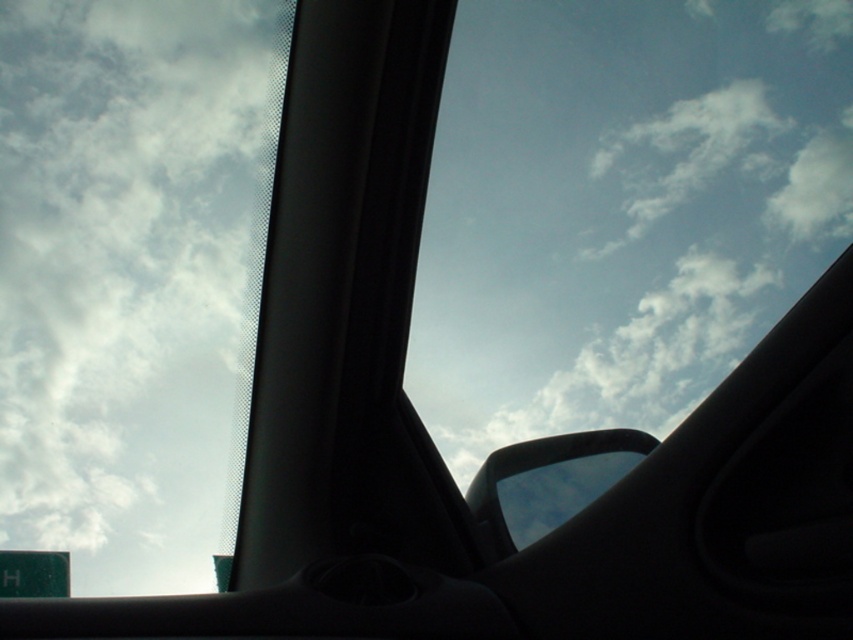
Which is more to the left, black glossy side mirror at center or green matte street sign at lower left?

From the viewer's perspective, green matte street sign at lower left appears more on the left side.

Where is `black glossy side mirror at center`? black glossy side mirror at center is located at coordinates (547, 483).

Does transparent glass car window at upper center have a greater width compared to black glossy side mirror at center?

Indeed, transparent glass car window at upper center has a greater width compared to black glossy side mirror at center.

Who is taller, transparent glass car window at upper center or black glossy side mirror at center?

transparent glass car window at upper center

Does point (766, 93) come closer to viewer compared to point (621, 474)?

No.

Where is `transparent glass car window at upper center`? This screenshot has width=853, height=640. transparent glass car window at upper center is located at coordinates (619, 209).

Between transparent glass car window at upper center and green matte street sign at lower left, which one is positioned higher?

transparent glass car window at upper center is higher up.

Which is more to the left, transparent glass car window at upper center or green matte street sign at lower left?

green matte street sign at lower left

Locate an element on the screen. This screenshot has width=853, height=640. transparent glass car window at upper center is located at coordinates (619, 209).

Image resolution: width=853 pixels, height=640 pixels. Identify the location of transparent glass car window at upper center. (619, 209).